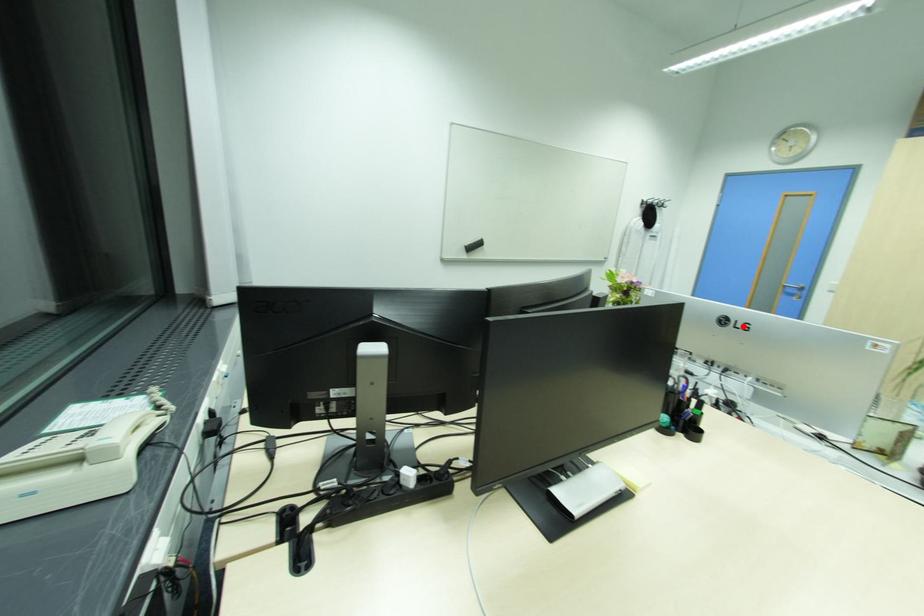
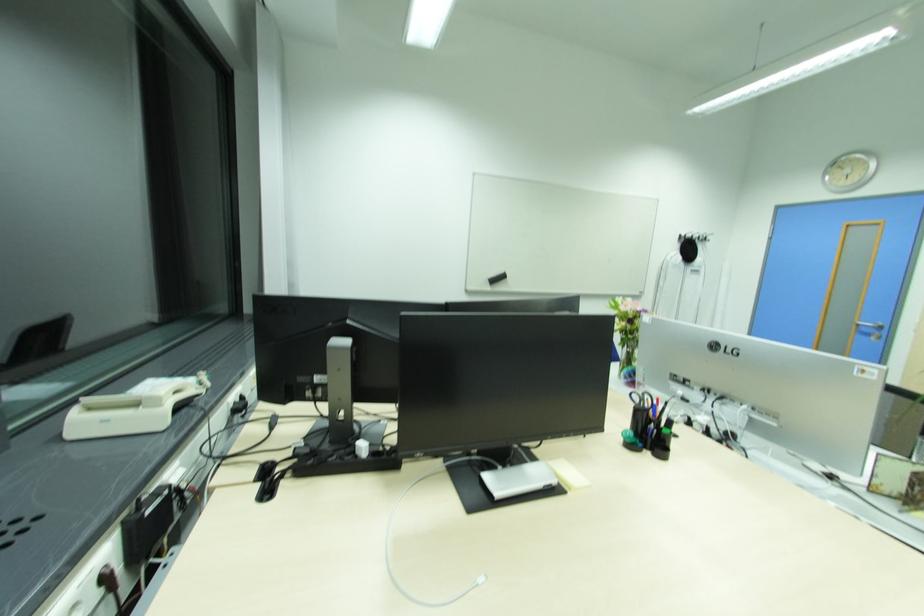
In the second image, find the point that corresponds to the highlighted location in the first image.

(734, 351)